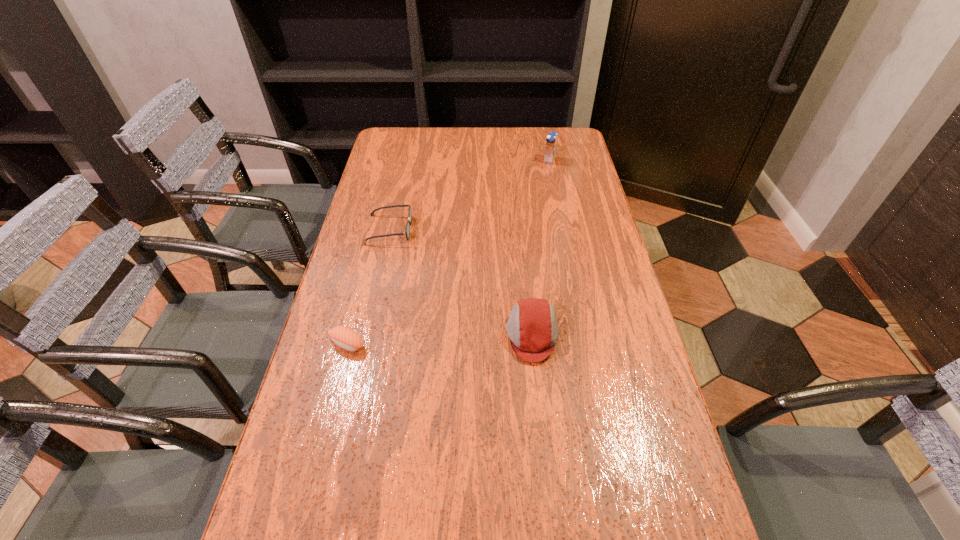
The height and width of the screenshot is (540, 960). Find the location of `free spot at the far left corner of the desktop`. free spot at the far left corner of the desktop is located at coordinates (414, 154).

In order to click on free space at the far right corner in this screenshot , I will do [545, 129].

Where is `vacant space that's between the cap and the spectacles`? This screenshot has width=960, height=540. vacant space that's between the cap and the spectacles is located at coordinates (461, 282).

You are a GUI agent. You are given a task and a screenshot of the screen. Output one action in this format:
    pyautogui.click(x=<x>, y=<y>)
    Task: Click on the vacant region between the cap and the sushi
    
    Given the screenshot: What is the action you would take?
    pyautogui.click(x=440, y=340)

Find the location of a particular element. This screenshot has width=960, height=540. free area in between the sushi and the rightmost object is located at coordinates (448, 252).

The image size is (960, 540). I want to click on empty space that is in between the spectacles and the sushi, so [x=368, y=287].

Locate an element on the screen. unoccupied area between the rightmost object and the third object from left to right is located at coordinates (540, 248).

Locate an element on the screen. Image resolution: width=960 pixels, height=540 pixels. unoccupied area between the sushi and the third nearest object is located at coordinates (368, 287).

Image resolution: width=960 pixels, height=540 pixels. Find the location of `free space between the sushi and the spectacles`. free space between the sushi and the spectacles is located at coordinates (368, 287).

You are a GUI agent. You are given a task and a screenshot of the screen. Output one action in this format:
    pyautogui.click(x=<x>, y=<y>)
    Task: Click on the vacant space in between the third shortest object and the sushi
    
    Given the screenshot: What is the action you would take?
    pyautogui.click(x=440, y=340)